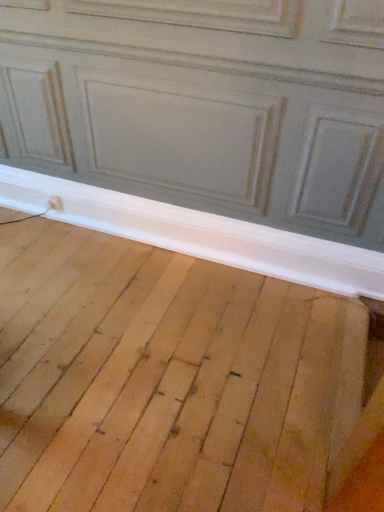
Question: Does point (167, 223) appear closer or farther from the camera than point (218, 428)?

Choices:
 (A) farther
 (B) closer

Answer: (A)

Question: Visually, is white wood baseboard at lower center positioned to the left or to the right of natural wood floor at lower center?

Choices:
 (A) right
 (B) left

Answer: (A)

Question: Looking at the image, does white wood baseboard at lower center seem bigger or smaller compared to natural wood floor at lower center?

Choices:
 (A) big
 (B) small

Answer: (B)

Question: Based on their positions, is natural wood floor at lower center located to the left or right of white wood baseboard at lower center?

Choices:
 (A) left
 (B) right

Answer: (A)

Question: From a real-world perspective, is natural wood floor at lower center physically located above or below white wood baseboard at lower center?

Choices:
 (A) below
 (B) above

Answer: (A)

Question: Considering the positions of natural wood floor at lower center and white wood baseboard at lower center in the image, is natural wood floor at lower center wider or thinner than white wood baseboard at lower center?

Choices:
 (A) thin
 (B) wide

Answer: (B)

Question: Considering their positions, is natural wood floor at lower center located in front of or behind white wood baseboard at lower center?

Choices:
 (A) front
 (B) behind

Answer: (A)